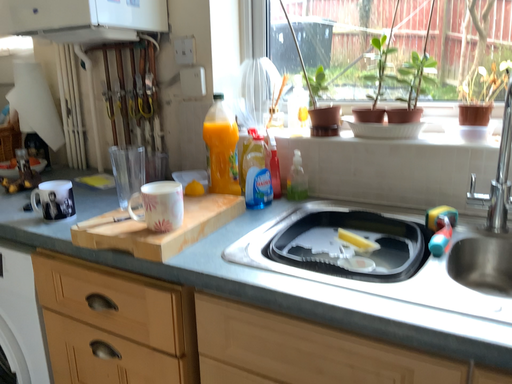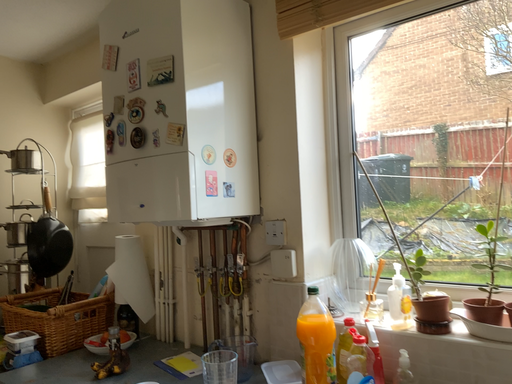
Question: How did the camera likely rotate when shooting the video?

Choices:
 (A) rotated upward
 (B) rotated downward

Answer: (A)